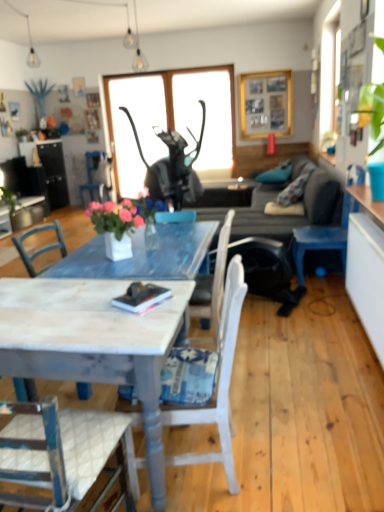
Question: Does blue painted wood chair at center, which appears as the third chair when viewed from the front, have a greater height compared to metallic black cat statue at upper center, the second window screen viewed from the right?

Choices:
 (A) no
 (B) yes

Answer: (A)

Question: Could you tell me if blue painted wood chair at center, which appears as the 1th chair when viewed from the back, is facing metallic black cat statue at upper center, the first window screen positioned from the left?

Choices:
 (A) yes
 (B) no

Answer: (B)

Question: Is blue painted wood chair at center, the 3th chair when ordered from bottom to top, turned away from metallic black cat statue at upper center, the first window screen positioned from the left?

Choices:
 (A) no
 (B) yes

Answer: (A)

Question: Considering the relative positions of blue painted wood chair at center, which appears as the 1th chair when viewed from the back, and metallic black cat statue at upper center, the second window screen viewed from the right, in the image provided, is blue painted wood chair at center, which appears as the 1th chair when viewed from the back, to the right of metallic black cat statue at upper center, the second window screen viewed from the right, from the viewer's perspective?

Choices:
 (A) yes
 (B) no

Answer: (B)

Question: Does blue painted wood chair at center, which appears as the 1th chair when viewed from the back, appear on the left side of metallic black cat statue at upper center, the second window screen viewed from the right?

Choices:
 (A) no
 (B) yes

Answer: (B)

Question: Is blue painted wood chair at center, the 3th chair when ordered from bottom to top, spatially inside wooden picture frame at upper center, or outside of it?

Choices:
 (A) inside
 (B) outside

Answer: (B)

Question: From a real-world perspective, relative to wooden picture frame at upper center, is blue painted wood chair at center, which ranks as the 1th chair in top-to-bottom order, vertically above or below?

Choices:
 (A) below
 (B) above

Answer: (A)

Question: Relative to wooden picture frame at upper center, is blue painted wood chair at center, the 3th chair when ordered from right to left, in front or behind?

Choices:
 (A) front
 (B) behind

Answer: (B)

Question: Is blue painted wood chair at center, which appears as the third chair when viewed from the front, to the left or to the right of wooden picture frame at upper center in the image?

Choices:
 (A) right
 (B) left

Answer: (B)

Question: From a real-world perspective, is white painted wood desk at center above or below blue painted wood chair at center, which appears as the third chair when viewed from the front?

Choices:
 (A) below
 (B) above

Answer: (A)

Question: Is white painted wood desk at center spatially inside blue painted wood chair at center, which appears as the 1th chair when viewed from the back, or outside of it?

Choices:
 (A) outside
 (B) inside

Answer: (A)

Question: Is white painted wood desk at center bigger or smaller than blue painted wood chair at center, the 1th chair viewed from the left?

Choices:
 (A) small
 (B) big

Answer: (B)

Question: Considering the relative positions of white painted wood desk at center and blue painted wood chair at center, which ranks as the 1th chair in top-to-bottom order, in the image provided, is white painted wood desk at center to the left or to the right of blue painted wood chair at center, which ranks as the 1th chair in top-to-bottom order,?

Choices:
 (A) right
 (B) left

Answer: (A)

Question: Considering the positions of transparent glass window screen at center, the 2th window screen viewed from the left, and metallic black cat statue at upper center, the first window screen positioned from the left, in the image, is transparent glass window screen at center, the 2th window screen viewed from the left, wider or thinner than metallic black cat statue at upper center, the first window screen positioned from the left,?

Choices:
 (A) thin
 (B) wide

Answer: (B)

Question: From a real-world perspective, is transparent glass window screen at center, which is the 1th window screen from right to left, physically located above or below metallic black cat statue at upper center, the first window screen positioned from the left?

Choices:
 (A) above
 (B) below

Answer: (A)